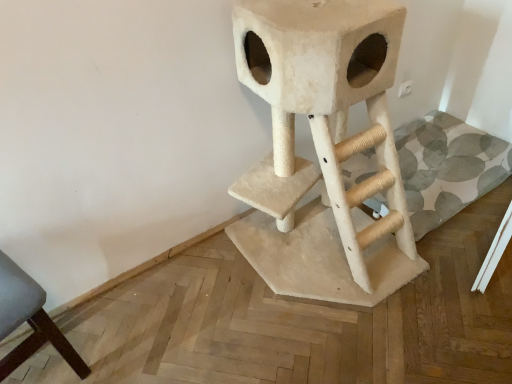
Locate an element on the screen. This screenshot has height=384, width=512. vacant space behind dark gray fabric chair at lower left is located at coordinates (90, 313).